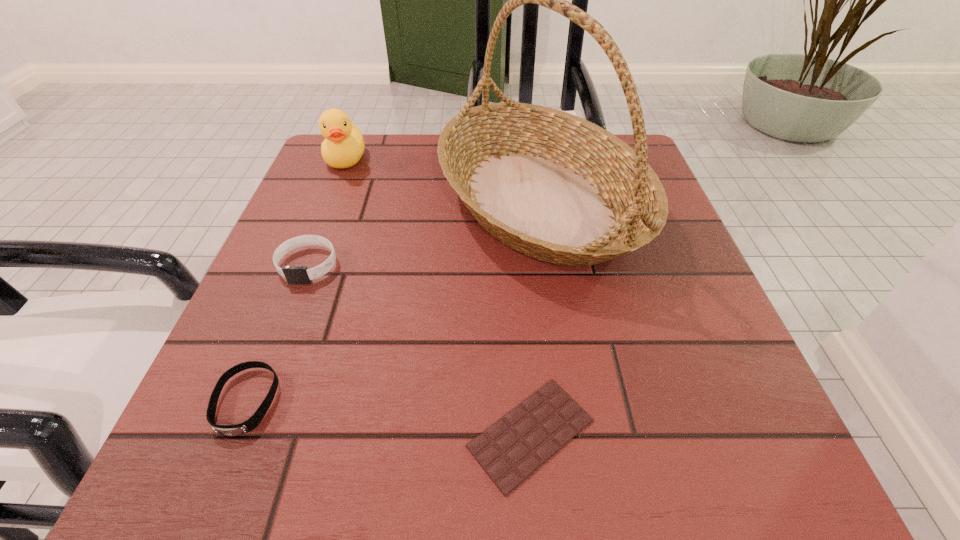
This screenshot has width=960, height=540. In order to click on free location that satisfies the following two spatial constraints: 1. on the display of the shortest object; 2. on the right side of the shorter wristband in this screenshot , I will do `click(233, 433)`.